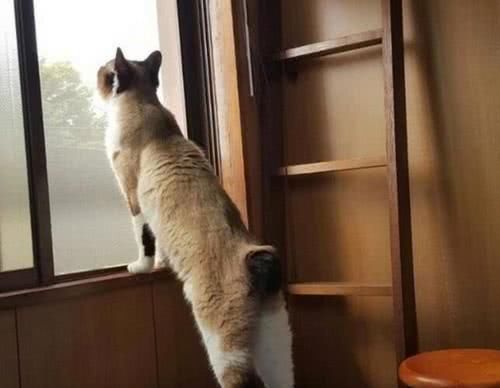
The width and height of the screenshot is (500, 388). I want to click on red wooden stool, so click(452, 372).